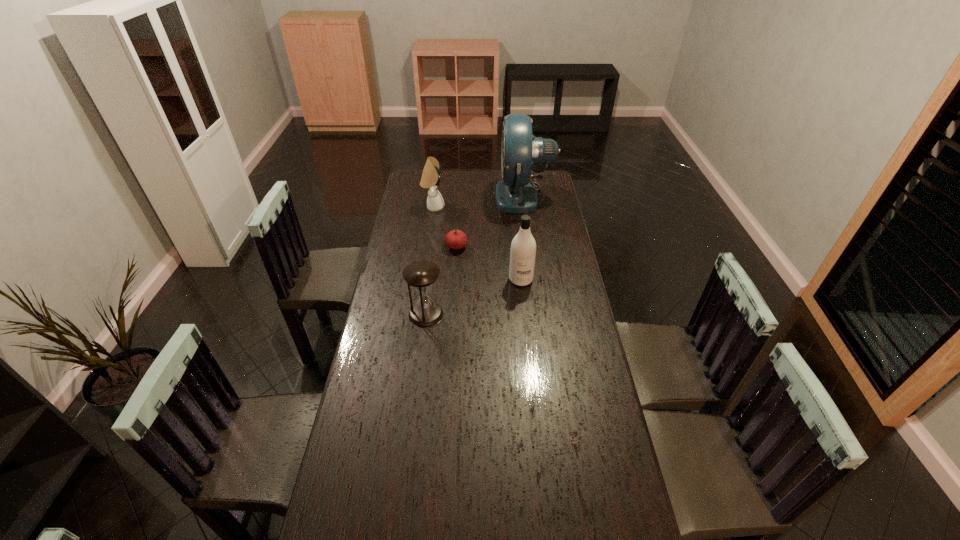
Locate an element on the screen. The height and width of the screenshot is (540, 960). vacant space located on the front-facing side of the shampoo is located at coordinates (526, 334).

Where is `vacant space located at the front face of the doll`? vacant space located at the front face of the doll is located at coordinates (470, 207).

At what (x,y) coordinates should I click in order to perform the action: click on vacant point located on the back of the nearest object. Please return your answer as a coordinate pair (x, y). Looking at the image, I should click on (435, 242).

Locate an element on the screen. Image resolution: width=960 pixels, height=540 pixels. vacant region located on the right of the shortest object is located at coordinates (549, 247).

Locate an element on the screen. Image resolution: width=960 pixels, height=540 pixels. object at the far edge is located at coordinates (516, 193).

Image resolution: width=960 pixels, height=540 pixels. Find the location of `doll that is at the left edge`. doll that is at the left edge is located at coordinates (430, 179).

In order to click on hourglass that is at the left edge in this screenshot , I will do `click(421, 275)`.

The width and height of the screenshot is (960, 540). In order to click on object that is at the right edge in this screenshot , I will do `click(516, 193)`.

Find the location of `object located at the far right corner`. object located at the far right corner is located at coordinates (516, 193).

Identify the location of vacant space at the far edge of the desktop. The width and height of the screenshot is (960, 540). (473, 176).